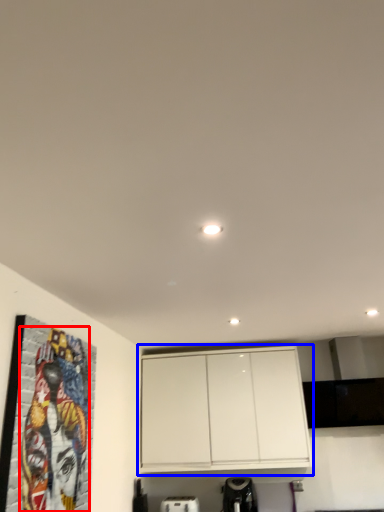
Question: Among these objects, which one is nearest to the camera, mural (highlighted by a red box) or cabinetry (highlighted by a blue box)?

Choices:
 (A) mural
 (B) cabinetry

Answer: (A)